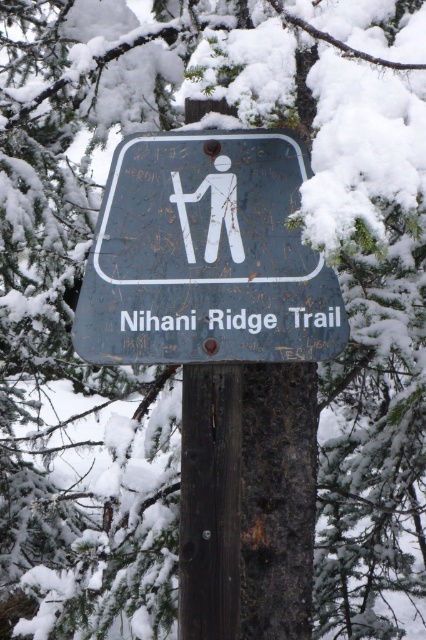
How far apart are matte blue sign at center and brown wood post at center?

A distance of 7.31 inches exists between matte blue sign at center and brown wood post at center.

Does matte blue sign at center appear over brown wood post at center?

Indeed, matte blue sign at center is positioned over brown wood post at center.

Describe the element at coordinates (206, 257) in the screenshot. I see `matte blue sign at center` at that location.

The image size is (426, 640). Find the location of `matte blue sign at center`. matte blue sign at center is located at coordinates (206, 257).